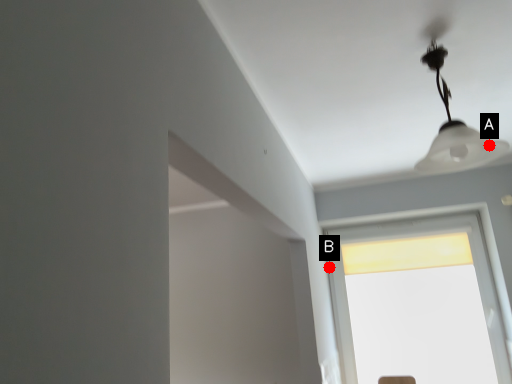
Question: Two points are circled on the image, labeled by A and B beside each circle. Which point is closer to the camera?

Choices:
 (A) A is closer
 (B) B is closer

Answer: (A)